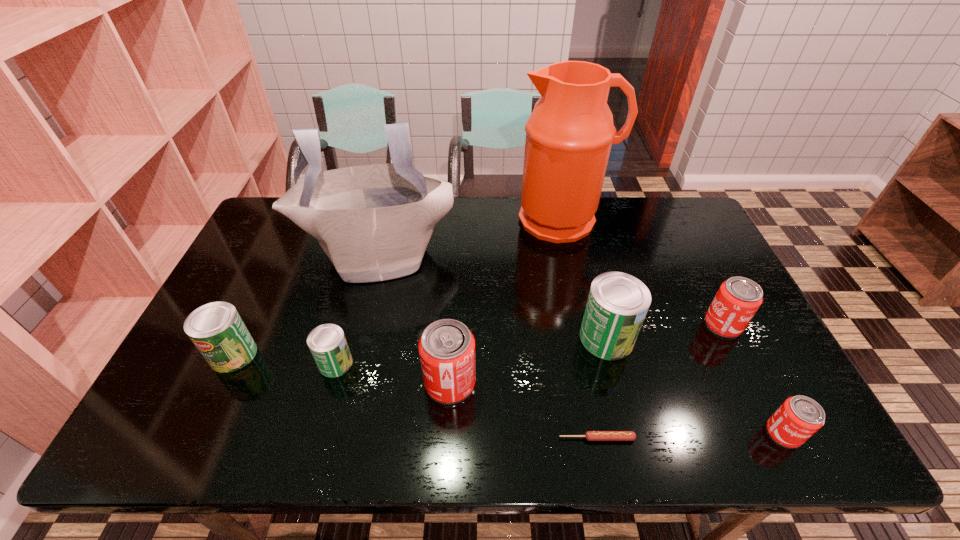
Image resolution: width=960 pixels, height=540 pixels. Identify the location of the smallest green can. (327, 343).

Locate an element on the screen. This screenshot has height=540, width=960. the nearest can is located at coordinates (799, 417).

Where is `the smallest red can`? The image size is (960, 540). the smallest red can is located at coordinates (799, 417).

Where is `sausage`? Image resolution: width=960 pixels, height=540 pixels. sausage is located at coordinates (589, 435).

Locate an element on the screen. The height and width of the screenshot is (540, 960). brown sausage is located at coordinates (589, 435).

Identify the location of free region located from the spout of the water jug. This screenshot has width=960, height=540. (573, 265).

In order to click on free space located on the front of the shopping bag in this screenshot , I will do [x=346, y=387].

Identify the location of vacant position located on the left of the biggest red can. (331, 383).

The image size is (960, 540). In order to click on vacant position located 0.190m on the front of the biggest green can in this screenshot , I will do `click(630, 431)`.

Find the location of a particular element. free region located on the back of the second biggest red can is located at coordinates (696, 271).